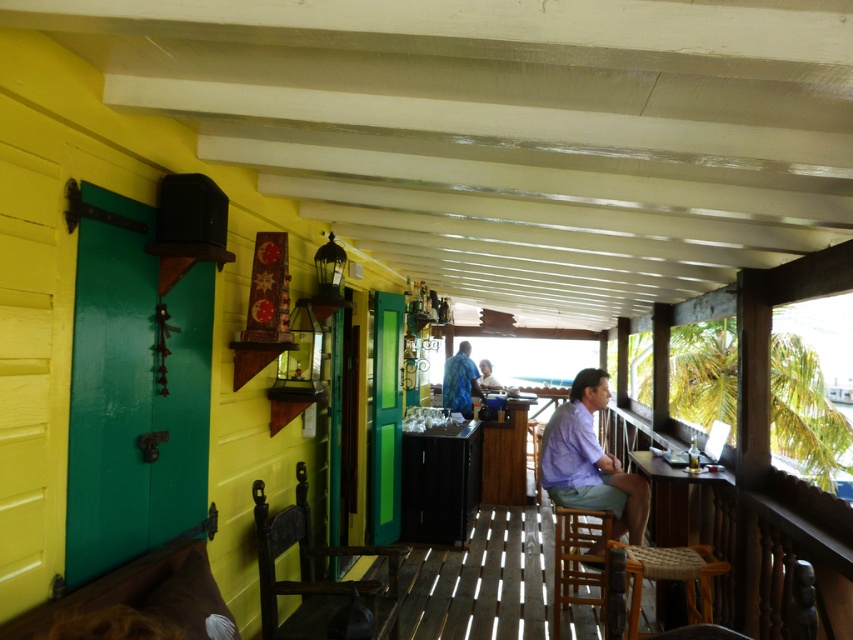
You are a customer looking for a seat in the bar. The wooden chair at left and the wooden stool at lower right are available. Which one is smaller in size?

The wooden chair at left is smaller in size compared to the wooden stool at lower right.

You are sitting in the wooden chair at left and want to reach the wooden stool at lower right to grab your bag. Which direction should you move to get to the stool?

Since the wooden chair at left is positioned on the left side of the wooden stool at lower right, you should move to your right to reach the stool.